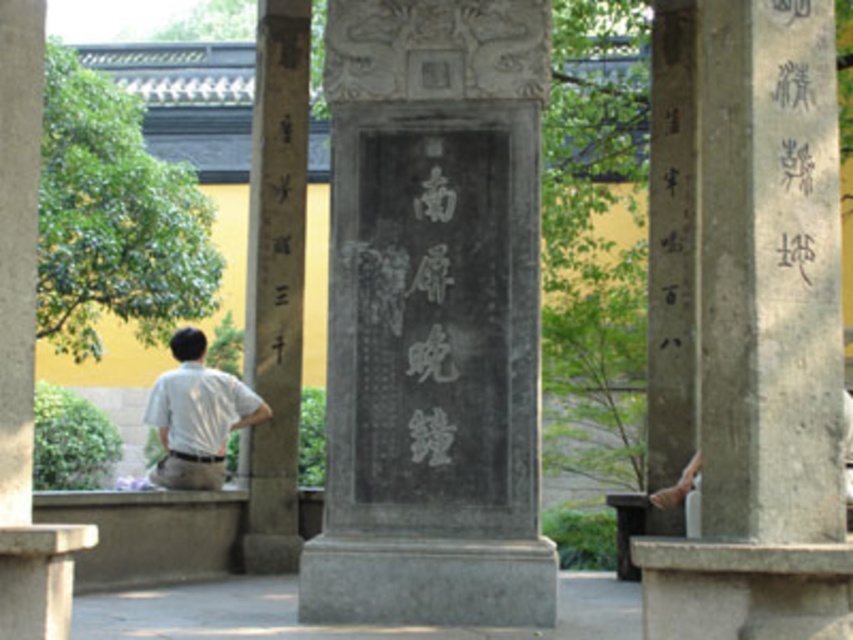
Between gray stone pillar at right and white shirt at left, which one appears on the right side from the viewer's perspective?

Positioned to the right is gray stone pillar at right.

Between gray stone pillar at right and white shirt at left, which one has more height?

Standing taller between the two is gray stone pillar at right.

Does point (683, 564) come farther from viewer compared to point (170, 456)?

No, (683, 564) is closer to viewer.

Find the location of a particular element. Image resolution: width=853 pixels, height=640 pixels. gray stone pillar at right is located at coordinates (763, 339).

Can you confirm if black stone plaque at center is thinner than gray stone pillar at right?

No, black stone plaque at center is not thinner than gray stone pillar at right.

Who is more distant from viewer, [343,573] or [787,138]?

Point [343,573]

Locate an element on the screen. The height and width of the screenshot is (640, 853). black stone plaque at center is located at coordinates (432, 317).

Who is lower down, black stone pillar at left or white shirt at left?

white shirt at left is below.

Who is positioned more to the right, black stone pillar at left or white shirt at left?

From the viewer's perspective, black stone pillar at left appears more on the right side.

What are the coordinates of `black stone pillar at left` in the screenshot? It's located at (276, 284).